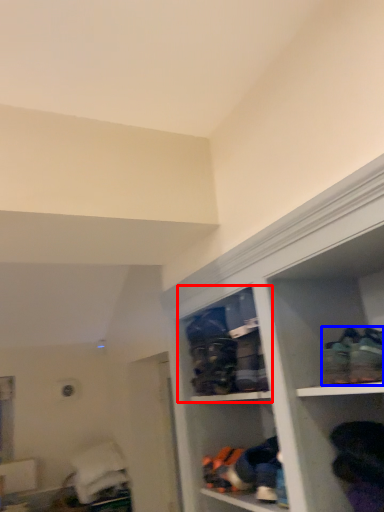
Question: Which of the following is the closest to the observer, cabinet (highlighted by a red box) or footwear (highlighted by a blue box)?

Choices:
 (A) cabinet
 (B) footwear

Answer: (B)